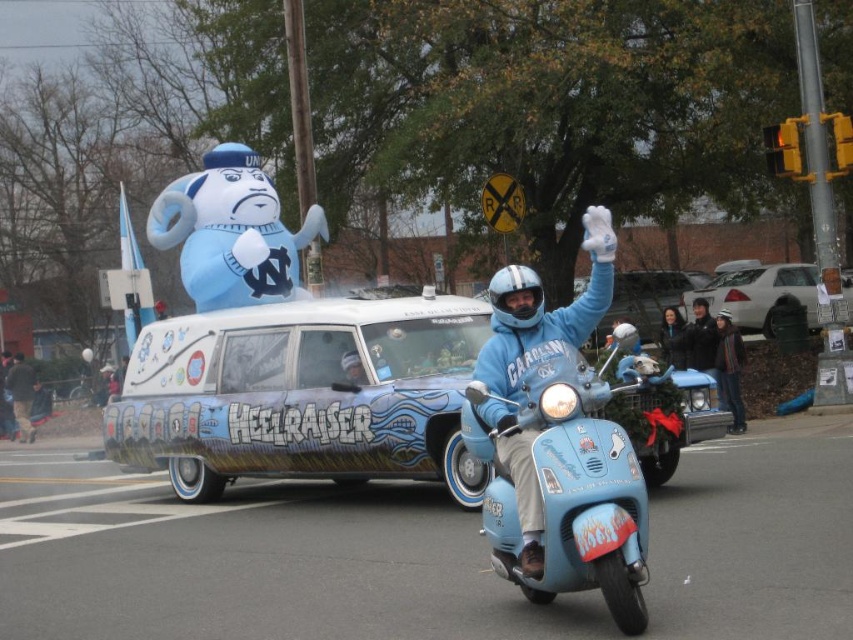
Consider the image. You are standing at the point marked as point (653,316) in the image. A friend is holding a camera and wants to take a photo of you and the light blue scooter with

The point (653,316) is 80.42 feet away from the viewer. Since the light blue scooter with

Looking at this image, you are standing at the point labeled point (12,400) and want to take a photo of the point labeled point (508,532). Which direction should you move to get a clearer shot?

Since point (508,532) is closer to the camera than point (12,400), you should move towards the direction of the camera to get a clearer shot of point (508,532).

You are standing at the parade and want to take a photo of the point at coordinates (577, 513). The camera you have can focus on objects within 15 feet. Will the point be in focus?

The point is 17.42 feet away from the viewer, which is beyond the camera focus range of 15 feet. The point will not be in focus.